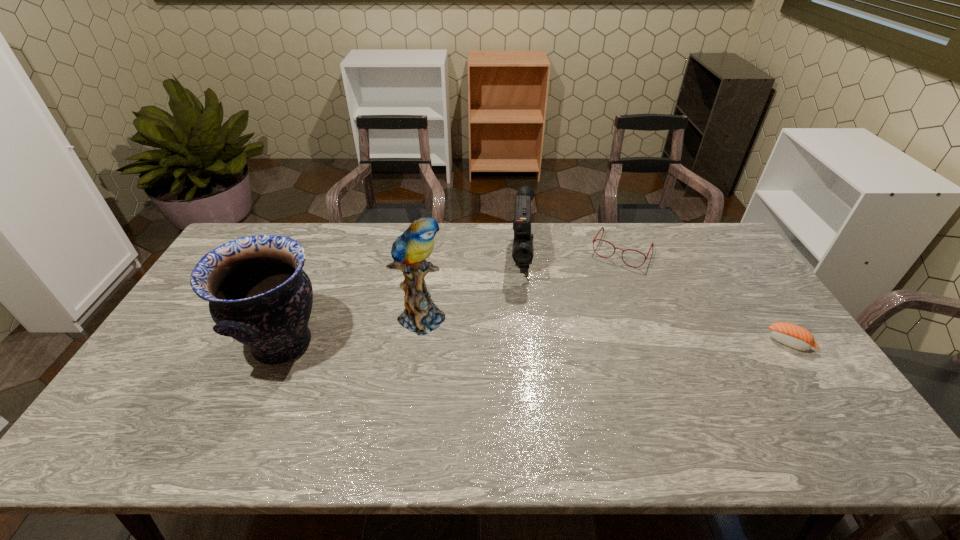
Identify the location of free space on the desktop that is between the pottery and the shortest object and is positioned on the face of the parrot. (484, 343).

The height and width of the screenshot is (540, 960). I want to click on vacant spot on the desktop that is between the leftmost object and the rightmost object and is positioned on the face of the fourth tallest object, so click(x=569, y=343).

The height and width of the screenshot is (540, 960). Find the location of `free spot on the desktop that is between the second tallest object and the rightmost object and is positioned on the front-facing side of the third tallest object`. free spot on the desktop that is between the second tallest object and the rightmost object and is positioned on the front-facing side of the third tallest object is located at coordinates (523, 343).